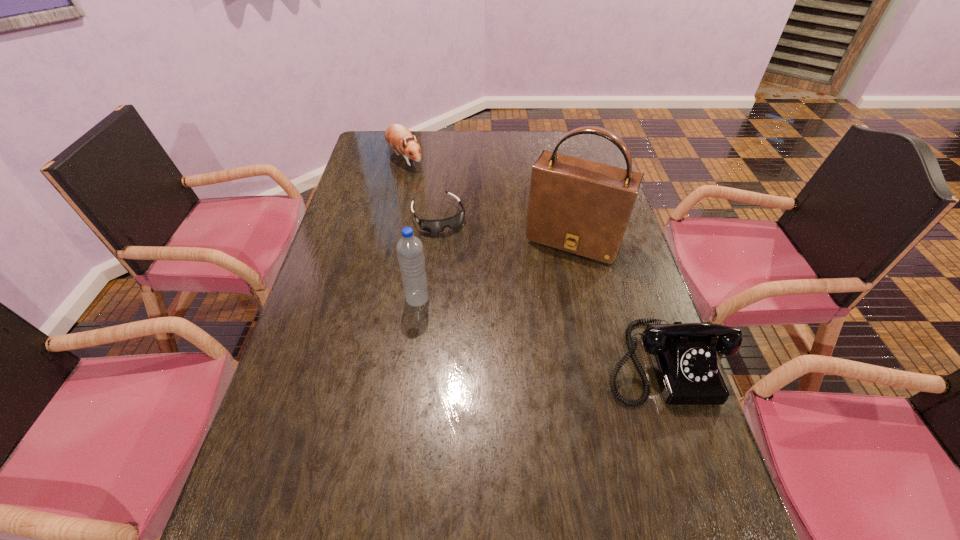
Locate an element on the screen. Image resolution: width=960 pixels, height=540 pixels. telephone situated at the right edge is located at coordinates (684, 357).

Image resolution: width=960 pixels, height=540 pixels. Identify the location of shoulder bag present at the right edge. (583, 207).

Identify the location of object at the far left corner. Image resolution: width=960 pixels, height=540 pixels. (397, 136).

What are the coordinates of `vacant space at the far edge of the desktop` in the screenshot? It's located at (501, 136).

Identify the location of free spot at the near edge of the desktop. This screenshot has width=960, height=540. (416, 484).

I want to click on vacant area at the left edge, so click(x=360, y=194).

In the image, there is a desktop. At what (x,y) coordinates should I click in order to perform the action: click on blank space at the right edge. Please return your answer as a coordinate pair (x, y). The width and height of the screenshot is (960, 540). Looking at the image, I should click on click(x=636, y=302).

Where is `vacant area at the far left corner`? This screenshot has width=960, height=540. vacant area at the far left corner is located at coordinates (376, 156).

Find the location of a particular element. The image size is (960, 540). free space at the near right corner of the desktop is located at coordinates (710, 507).

Find the location of a particular element. Image resolution: width=960 pixels, height=540 pixels. vacant area that lies between the shoulder bag and the hamster is located at coordinates (490, 199).